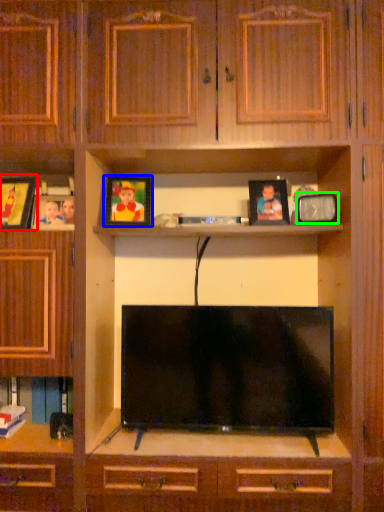
Question: Which object is positioned farthest from picture frame (highlighted by a red box)? Select from picture frame (highlighted by a blue box) and picture frame (highlighted by a green box).

Choices:
 (A) picture frame
 (B) picture frame

Answer: (B)